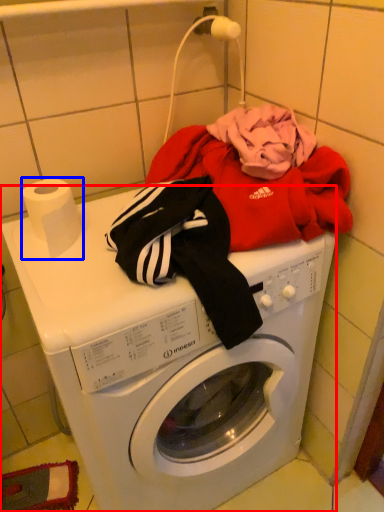
Question: Which point is further to the camera, washing machine (highlighted by a red box) or toilet paper (highlighted by a blue box)?

Choices:
 (A) washing machine
 (B) toilet paper

Answer: (B)